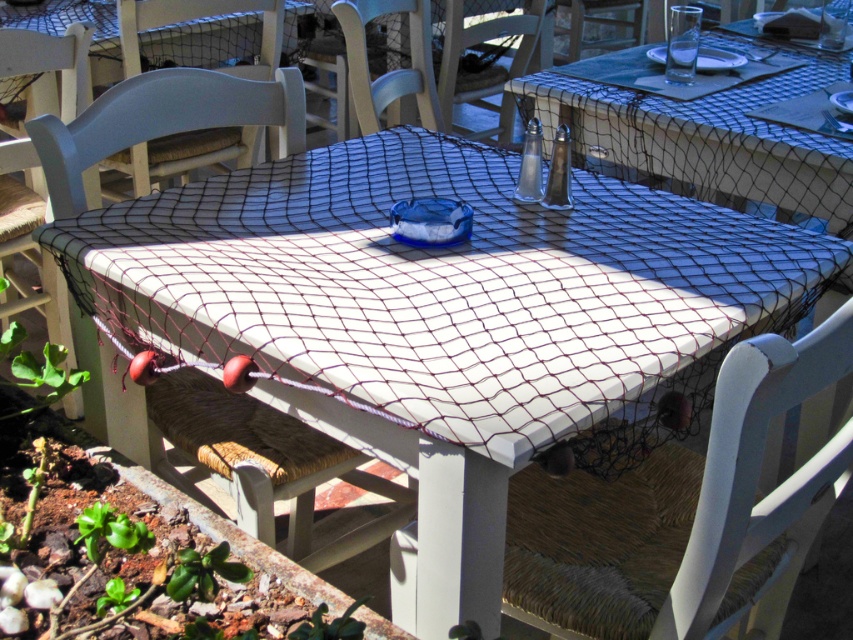
You are a server at the seaside restaurant and need to place a new menu on the table. You see the metallic silver salt shaker at upper center and the wooden chair at center. Where should you place the menu to ensure it is visible and not blocked by the chair?

The metallic silver salt shaker at upper center is positioned under the wooden chair at center, so placing the menu above or to the side of the metallic silver salt shaker at upper center would keep it visible and avoid obstruction from the wooden chair at center.

You are a customer sitting at the table and want to reach the metallic silver salt shaker at upper center. Is the wooden chair at center blocking your access to it?

The metallic silver salt shaker at upper center is closer to the viewer than the wooden chair at center, so the chair is not blocking the access to the salt shaker.

You are standing at point 0.0, 0.0 and want to move to the white wicker chair at center located at point (265,464). What direction should you walk to reach it?

You should walk northeast to reach the white wicker chair at center located at point (265,464) since it is in the northeast direction from your current position at 0.0, 0.0.